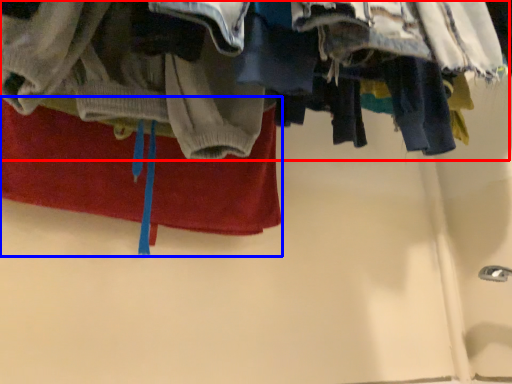
Question: Which point is further to the camera, closet (highlighted by a red box) or towel (highlighted by a blue box)?

Choices:
 (A) closet
 (B) towel

Answer: (B)